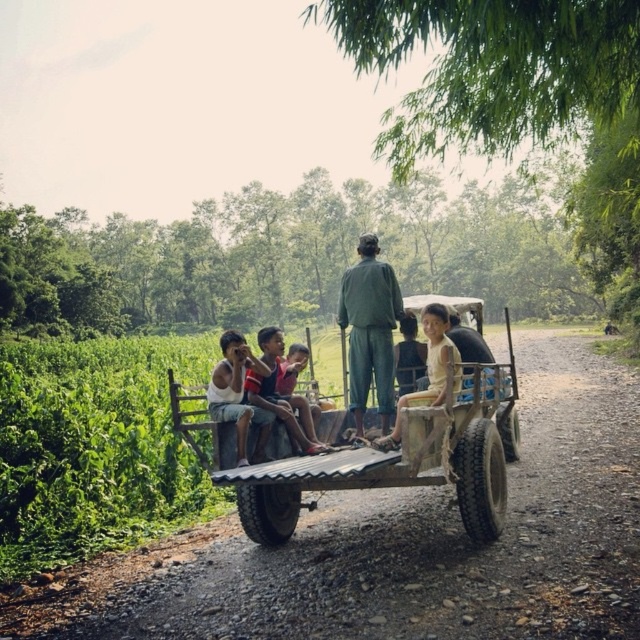
Between brown gravel road at center and green fabric shirt at center, which one appears on the right side from the viewer's perspective?

Positioned to the right is brown gravel road at center.

Can you confirm if brown gravel road at center is taller than green fabric shirt at center?

→ No.

Does point (154, 609) lie behind point (378, 280)?

No, it is in front of (378, 280).

Where is `brown gravel road at center`? brown gravel road at center is located at coordinates (410, 544).

Is green fabric shirt at center positioned before light beige fabric shirt at center?

No, green fabric shirt at center is behind light beige fabric shirt at center.

Can you confirm if green fabric shirt at center is positioned to the right of light beige fabric shirt at center?

Incorrect, green fabric shirt at center is not on the right side of light beige fabric shirt at center.

Is point (372, 333) farther from camera compared to point (435, 340)?

Yes, it is.

This screenshot has width=640, height=640. Find the location of `green fabric shirt at center`. green fabric shirt at center is located at coordinates (369, 330).

Does point (348, 364) come behind point (292, 417)?

Yes, point (348, 364) is farther from viewer.

Who is higher up, green fabric shirt at center or light brown fabric shirt at center?

green fabric shirt at center

The height and width of the screenshot is (640, 640). What do you see at coordinates (369, 330) in the screenshot?
I see `green fabric shirt at center` at bounding box center [369, 330].

Where is `green fabric shirt at center`? The image size is (640, 640). green fabric shirt at center is located at coordinates (369, 330).